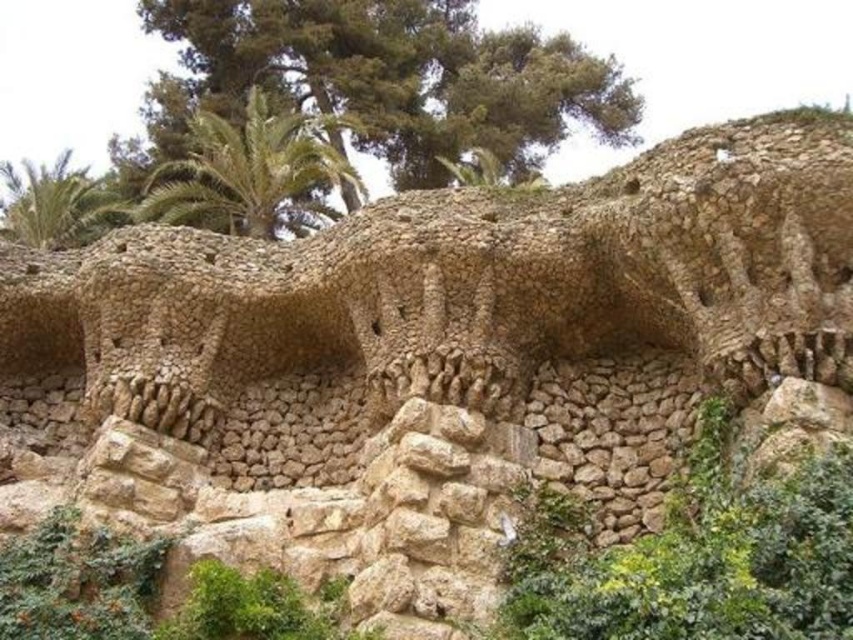
Question: Which point appears farthest from the camera in this image?

Choices:
 (A) (144, 202)
 (B) (793, 504)

Answer: (A)

Question: Is green mossy rock at center positioned at the back of green leafy palm tree at upper left?

Choices:
 (A) yes
 (B) no

Answer: (B)

Question: Is green mossy rock at center to the left of green leafy palm tree at upper center from the viewer's perspective?

Choices:
 (A) no
 (B) yes

Answer: (A)

Question: Estimate the real-world distances between objects in this image. Which object is closer to the green leafy tree at upper center?

Choices:
 (A) green leafy palm tree at upper left
 (B) green leafy shrub at lower left
 (C) green mossy rock at center

Answer: (A)

Question: Considering the real-world distances, which object is farthest from the green leafy tree at upper center?

Choices:
 (A) green leafy palm tree at upper center
 (B) green mossy rock at center
 (C) green leafy palm tree at upper left
 (D) green leafy shrub at lower left

Answer: (B)

Question: Is green leafy tree at upper center further to the viewer compared to green mossy rock at center?

Choices:
 (A) yes
 (B) no

Answer: (A)